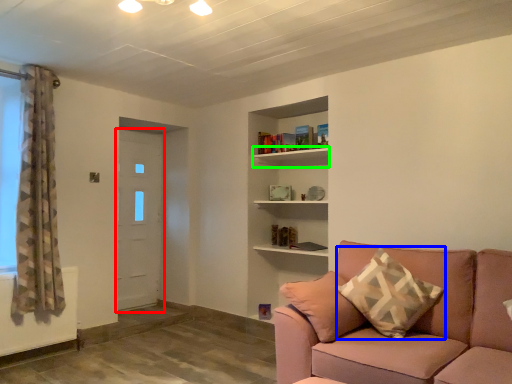
Question: Which is farther away from door (highlighted by a red box)? pillow (highlighted by a blue box) or shelf (highlighted by a green box)?

Choices:
 (A) pillow
 (B) shelf

Answer: (A)